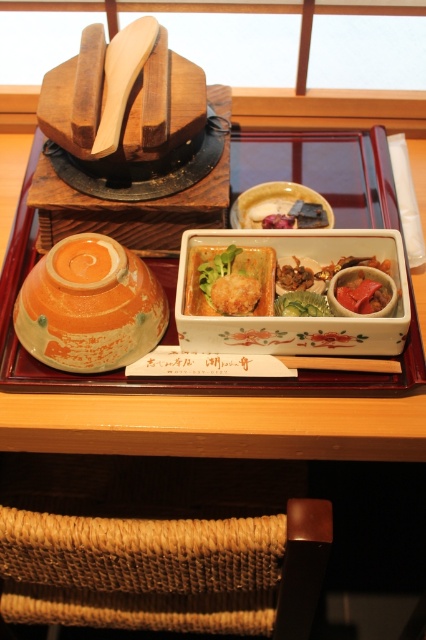
Question: Estimate the real-world distances between objects in this image. Which object is closer to the wooden tray at center?

Choices:
 (A) matte green leafy vegetable at center
 (B) wooden chopsticks at center
 (C) smooth red meat at center
 (D) matte orange bowl at left

Answer: (B)

Question: Is wooden tray at center positioned before smooth red meat at center?

Choices:
 (A) no
 (B) yes

Answer: (B)

Question: Among these points, which one is nearest to the camera?

Choices:
 (A) (80, 348)
 (B) (236, 301)
 (C) (224, 266)
 (D) (204, 401)

Answer: (A)

Question: Is wooden tray at center to the left of matte orange bowl at left from the viewer's perspective?

Choices:
 (A) yes
 (B) no

Answer: (B)

Question: Can you confirm if matte orange bowl at left is smaller than matte green leafy vegetable at center?

Choices:
 (A) no
 (B) yes

Answer: (A)

Question: Which of the following is the closest to the observer?

Choices:
 (A) (52, 401)
 (B) (367, 285)
 (C) (279, 259)

Answer: (A)